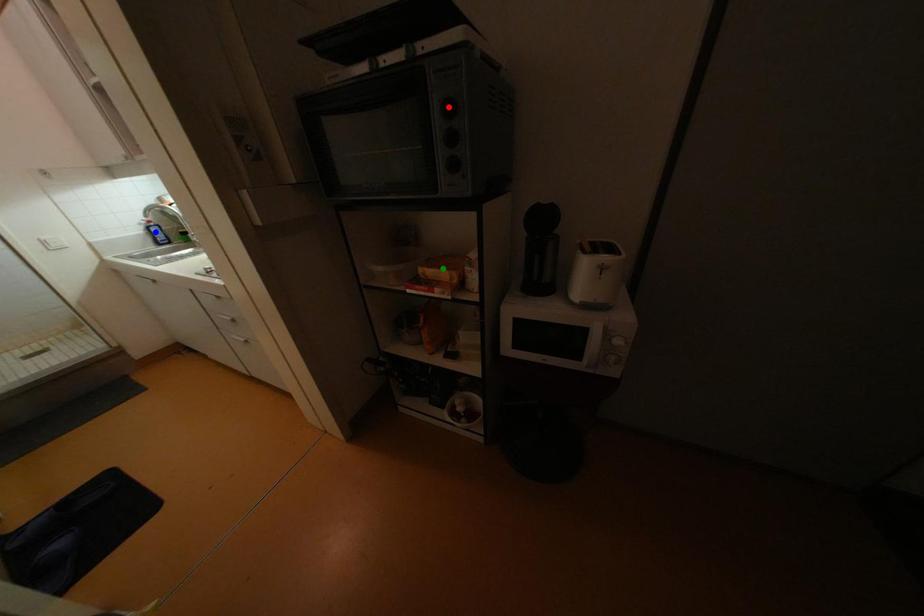
Consider the image. Order these from farthest to nearest:
A) green point
B) blue point
C) red point

blue point → green point → red point